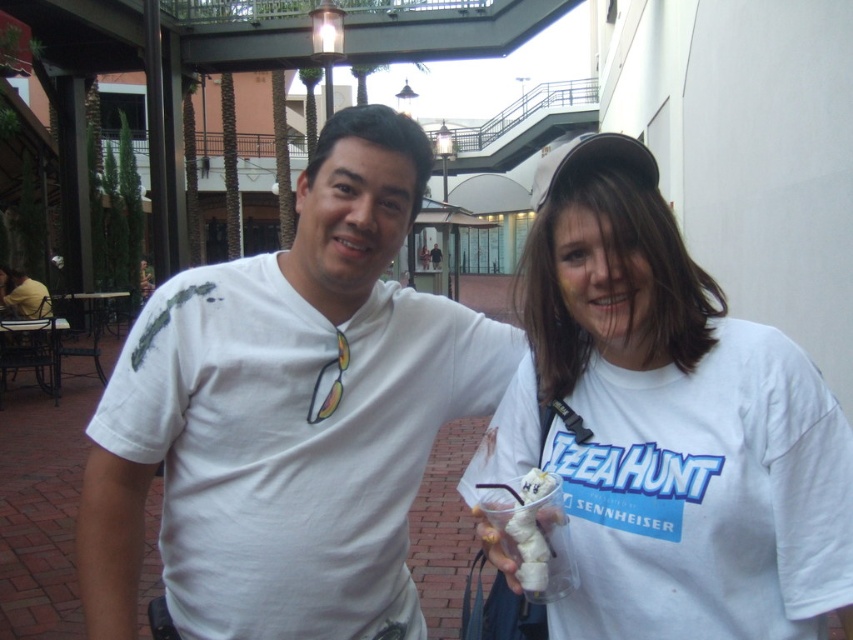
Question: Does white matte t-shirt at center have a greater width compared to white creamy ice cream at center?

Choices:
 (A) no
 (B) yes

Answer: (B)

Question: Which is nearer to the matte white shirt at left?

Choices:
 (A) white cotton t-shirt at center
 (B) white creamy ice cream at center
 (C) white matte t-shirt at center

Answer: (C)

Question: Which of the following is the closest to the observer?

Choices:
 (A) matte white shirt at left
 (B) white creamy ice cream at center
 (C) white matte t-shirt at center

Answer: (B)

Question: Among these points, which one is farthest from the camera?

Choices:
 (A) (526, 540)
 (B) (10, 300)

Answer: (B)

Question: Does white cotton t-shirt at center appear on the left side of white creamy ice cream at center?

Choices:
 (A) no
 (B) yes

Answer: (A)

Question: Can you confirm if white cotton t-shirt at center is positioned below matte white shirt at left?

Choices:
 (A) no
 (B) yes

Answer: (B)